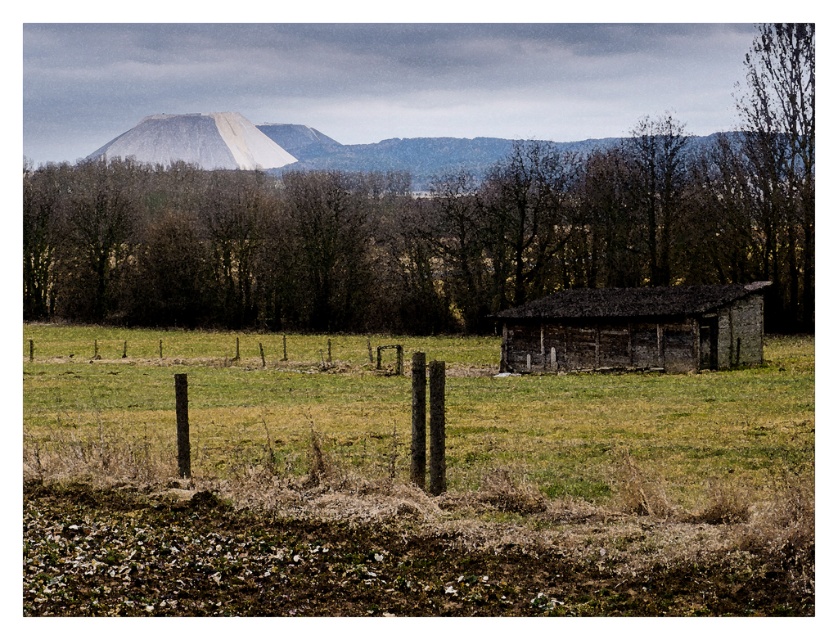
Based on the scene description, where is the weathered wood barn at center located in terms of its 2D coordinates?

The weathered wood barn at center is located at the 2D coordinates of point [635,328].